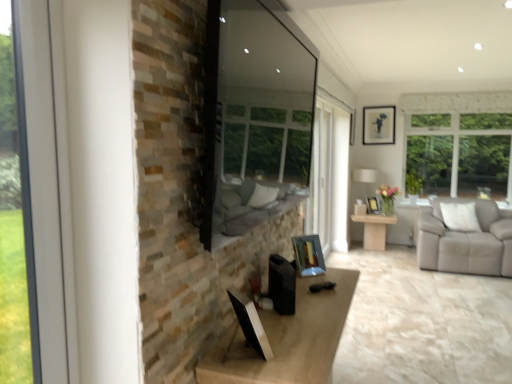
Question: Is light wood table at center shorter than transparent glass window screen at center?

Choices:
 (A) no
 (B) yes

Answer: (B)

Question: From a real-world perspective, is light wood table at center physically below transparent glass window screen at center?

Choices:
 (A) yes
 (B) no

Answer: (A)

Question: From a real-world perspective, is light wood table at center on top of transparent glass window screen at center?

Choices:
 (A) yes
 (B) no

Answer: (B)

Question: Is the depth of light wood table at center less than that of transparent glass window screen at center?

Choices:
 (A) yes
 (B) no

Answer: (B)

Question: From the image's perspective, is light wood table at center under transparent glass window screen at center?

Choices:
 (A) yes
 (B) no

Answer: (A)

Question: Relative to transparent glass window screen at center, is clear glass window at left in front or behind?

Choices:
 (A) front
 (B) behind

Answer: (A)

Question: Looking at their shapes, would you say clear glass window at left is wider or thinner than transparent glass window screen at center?

Choices:
 (A) wide
 (B) thin

Answer: (B)

Question: Is clear glass window at left spatially inside transparent glass window screen at center, or outside of it?

Choices:
 (A) outside
 (B) inside

Answer: (A)

Question: Is clear glass window at left taller or shorter than transparent glass window screen at center?

Choices:
 (A) short
 (B) tall

Answer: (B)

Question: Relative to transparent glass window screen at center, is white fabric lampshade at right in front or behind?

Choices:
 (A) behind
 (B) front

Answer: (A)

Question: From a real-world perspective, relative to transparent glass window screen at center, is white fabric lampshade at right vertically above or below?

Choices:
 (A) above
 (B) below

Answer: (B)

Question: Is white fabric lampshade at right to the left or to the right of transparent glass window screen at center in the image?

Choices:
 (A) left
 (B) right

Answer: (B)

Question: Does point (370, 175) appear closer or farther from the camera than point (296, 44)?

Choices:
 (A) farther
 (B) closer

Answer: (A)

Question: Considering the positions of transparent glass window screen at center and metallic silver picture frame at center-right, positioned as the 2th picture frame in back-to-front order, in the image, is transparent glass window screen at center bigger or smaller than metallic silver picture frame at center-right, positioned as the 2th picture frame in back-to-front order,?

Choices:
 (A) big
 (B) small

Answer: (A)

Question: Is point (211, 155) closer or farther from the camera than point (376, 205)?

Choices:
 (A) farther
 (B) closer

Answer: (B)